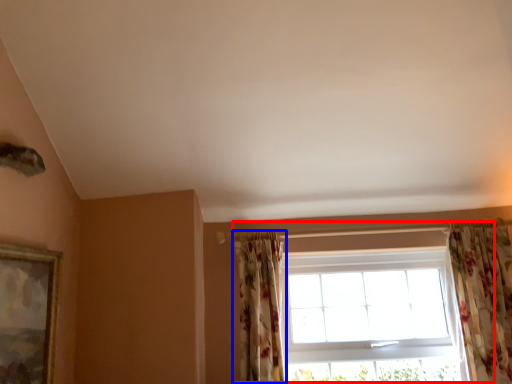
Question: Which object appears closest to the camera in this image, window (highlighted by a red box) or curtain (highlighted by a blue box)?

Choices:
 (A) window
 (B) curtain

Answer: (B)